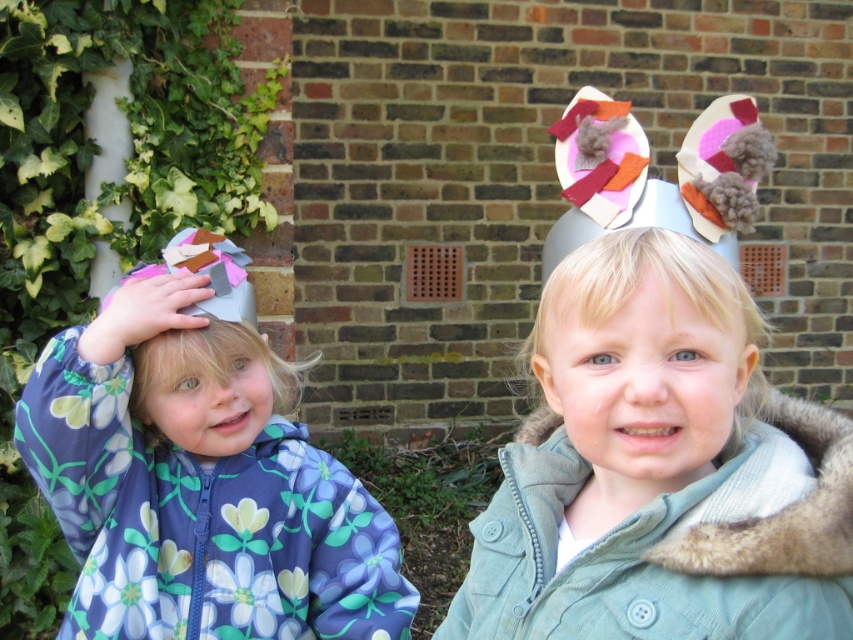
Who is more distant from viewer, (85, 470) or (225, 394)?

Positioned behind is point (85, 470).

Based on the photo, how far apart are floral fabric jacket at left and fluffy white hat at left?

floral fabric jacket at left and fluffy white hat at left are 2.43 inches apart.

Find the location of a particular element. This screenshot has width=853, height=640. floral fabric jacket at left is located at coordinates (199, 484).

Is light green corduroy jacket at center above fuzzy gray hat at center?

No.

This screenshot has width=853, height=640. Describe the element at coordinates (660, 467) in the screenshot. I see `light green corduroy jacket at center` at that location.

Between point (682, 582) and point (676, 256), which one is positioned in front?

Point (682, 582) is more forward.

This screenshot has width=853, height=640. Find the location of `light green corduroy jacket at center`. light green corduroy jacket at center is located at coordinates [x=660, y=467].

Between light green corduroy jacket at center and fluffy white hat at left, which one has more height?

light green corduroy jacket at center is taller.

Is light green corduroy jacket at center to the left of fluffy white hat at left from the viewer's perspective?

No, light green corduroy jacket at center is not to the left of fluffy white hat at left.

What do you see at coordinates (660, 467) in the screenshot?
I see `light green corduroy jacket at center` at bounding box center [660, 467].

Find the location of a particular element. The image size is (853, 640). light green corduroy jacket at center is located at coordinates (660, 467).